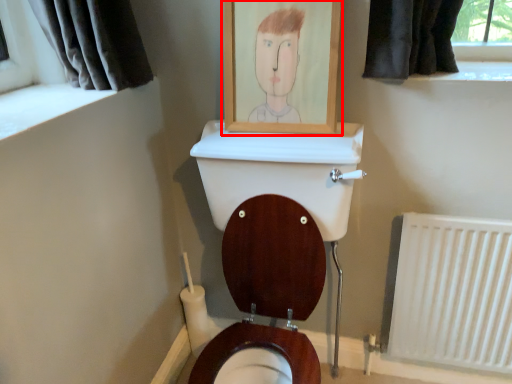
Question: From the image's perspective, where is picture frame (annotated by the red box) located relative to radiator?

Choices:
 (A) below
 (B) above

Answer: (B)